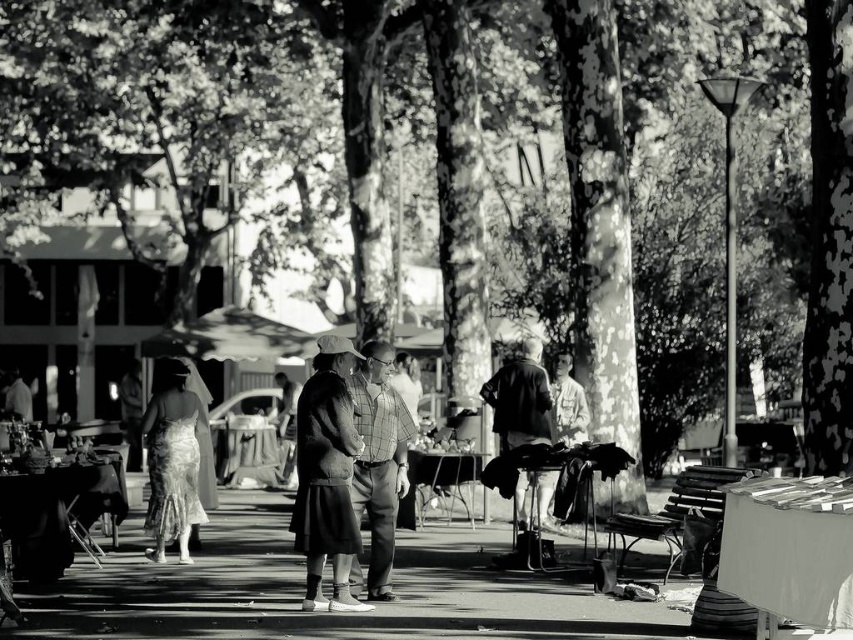
Is checkered fabric shirt at center bigger than silky white dress at center?

Incorrect, checkered fabric shirt at center is not larger than silky white dress at center.

Who is higher up, checkered fabric shirt at center or silky white dress at center?

checkered fabric shirt at center is higher up.

This screenshot has height=640, width=853. What do you see at coordinates (379, 460) in the screenshot? I see `checkered fabric shirt at center` at bounding box center [379, 460].

Identify the location of checkered fabric shirt at center. (379, 460).

Does point (320, 358) come farther from viewer compared to point (364, 493)?

No, (320, 358) is closer to viewer.

The height and width of the screenshot is (640, 853). Find the location of `checkered fabric jacket at center`. checkered fabric jacket at center is located at coordinates (326, 476).

Looking at this image, which is more to the right, checkered fabric jacket at center or light brown textured jacket at center?

From the viewer's perspective, light brown textured jacket at center appears more on the right side.

From the picture: Is checkered fabric jacket at center wider than light brown textured jacket at center?

No, checkered fabric jacket at center is not wider than light brown textured jacket at center.

Find the location of a particular element. This screenshot has width=853, height=640. checkered fabric jacket at center is located at coordinates tap(326, 476).